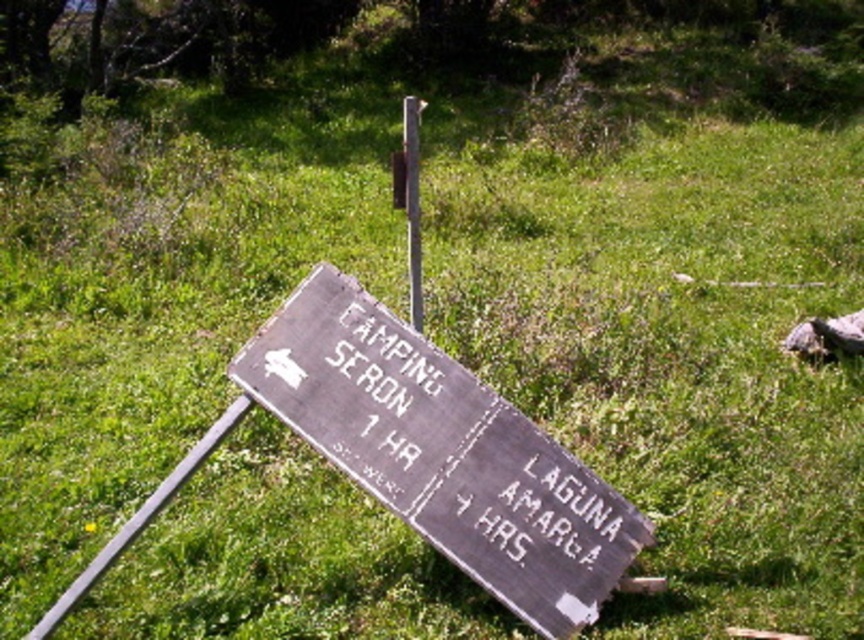
You are standing at the wooden signpost in the grassy area. There are two points marked on the signpost. One is at coordinate point (569, 600) and the other is at point (414, 125). From your perspective, which point is closer to you?

Point (569, 600) is in front of point (414, 125), so the point at (569, 600) is closer to you.

You are a hiker who needs to adjust the signpost to make it more visible. Since the weathered wood sign at lower center and the metallic pole at center are both part of the structure, which object should you focus on to ensure the sign is upright and visible to passersby?

The weathered wood sign at lower center is closer to the viewer than the metallic pole at center, so focusing on adjusting the sign to be upright would make it more visible.